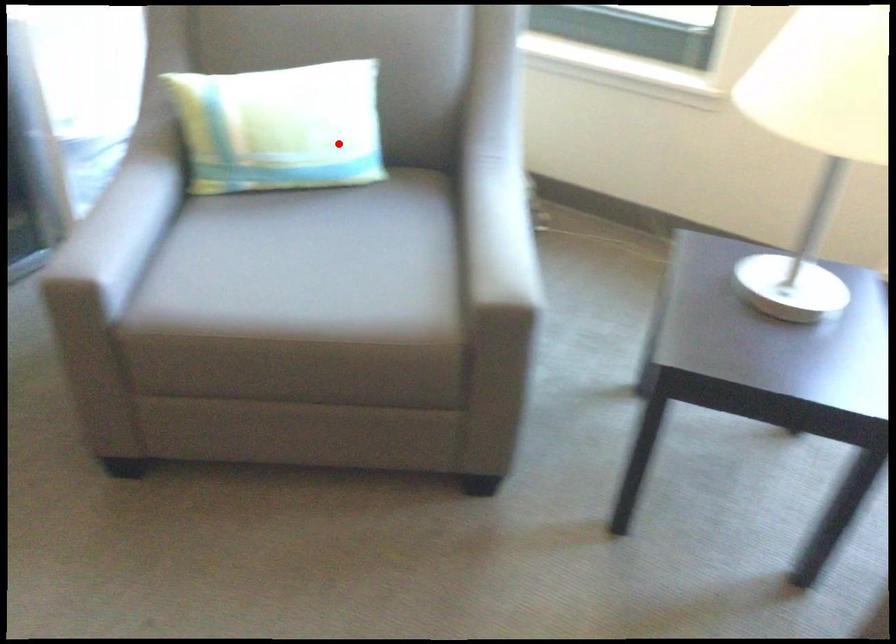
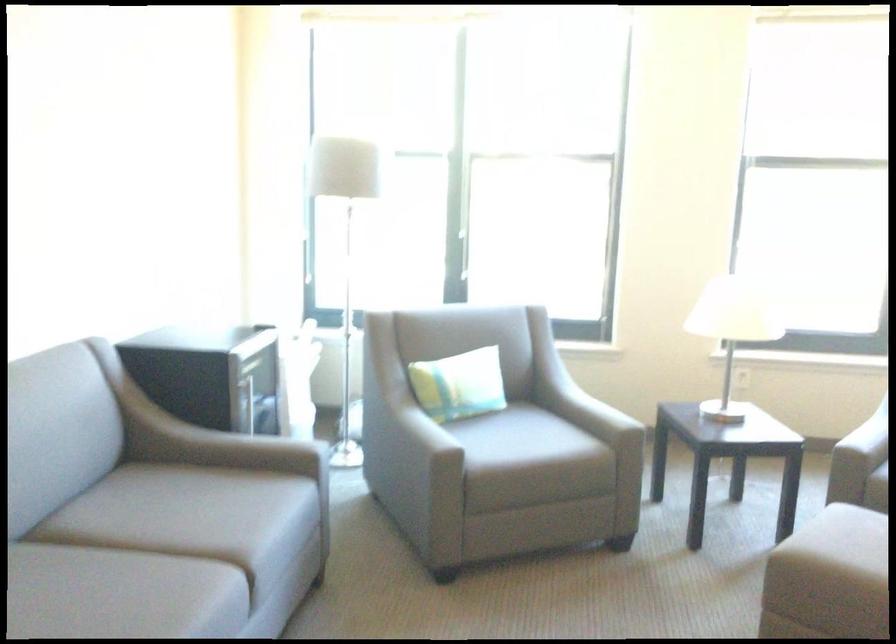
Question: I am providing you with two images of the same scene from different viewpoints. Given a red point in image1, look at the same physical point in image2. Is it:

Choices:
 (A) Closer to the viewpoint
 (B) Farther from the viewpoint

Answer: (B)